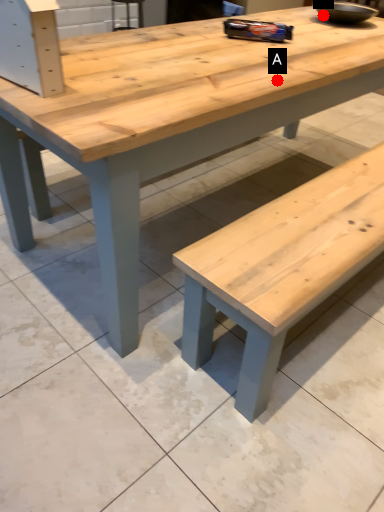
Question: Two points are circled on the image, labeled by A and B beside each circle. Which of the following is the closest to the observer?

Choices:
 (A) A is closer
 (B) B is closer

Answer: (A)